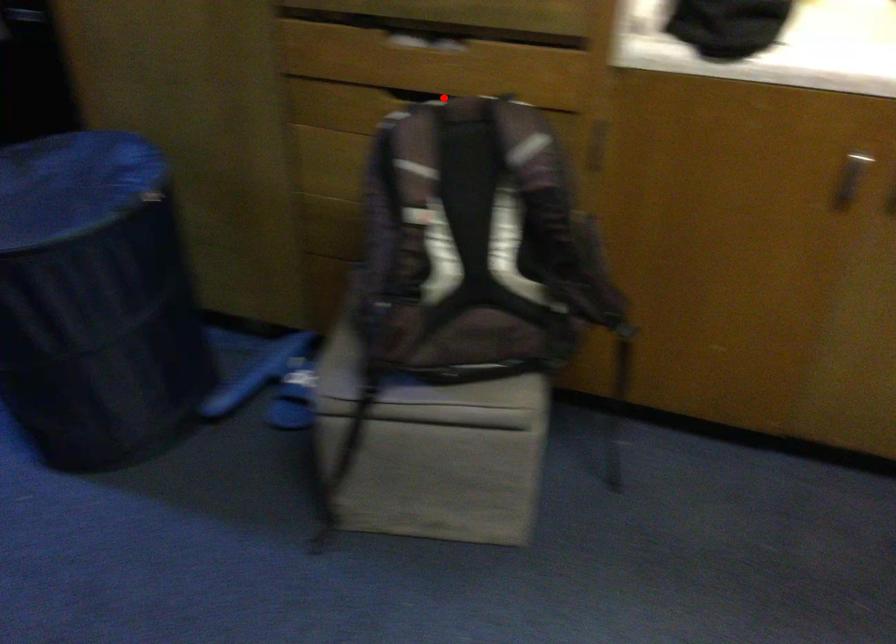
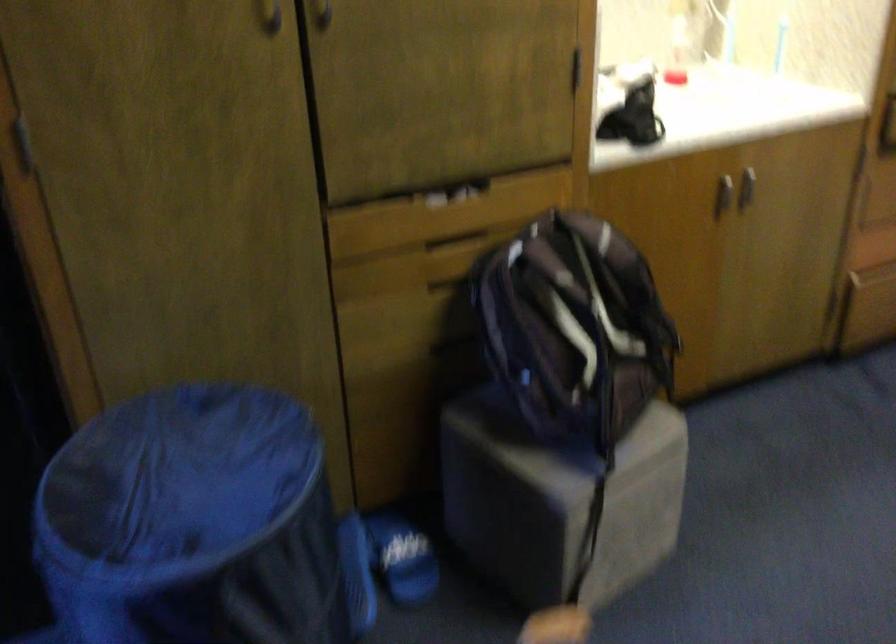
The point at the highlighted location is marked in the first image. Where is the corresponding point in the second image?

(455, 242)